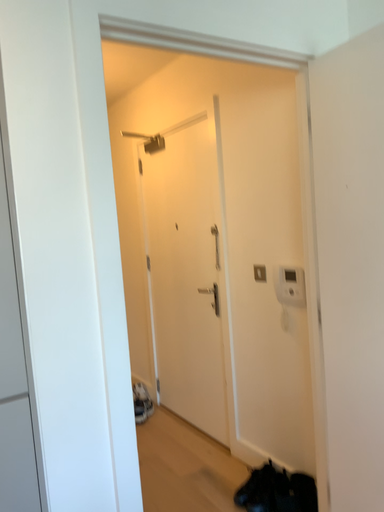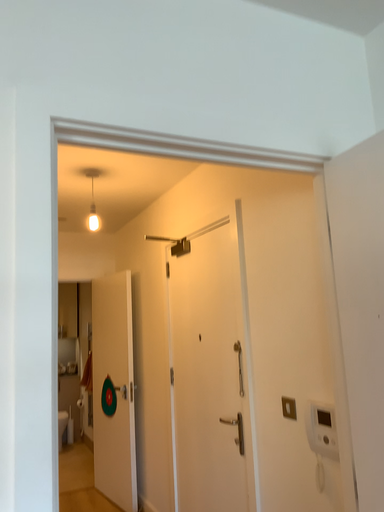
Question: How did the camera likely rotate when shooting the video?

Choices:
 (A) rotated upward
 (B) rotated downward

Answer: (A)